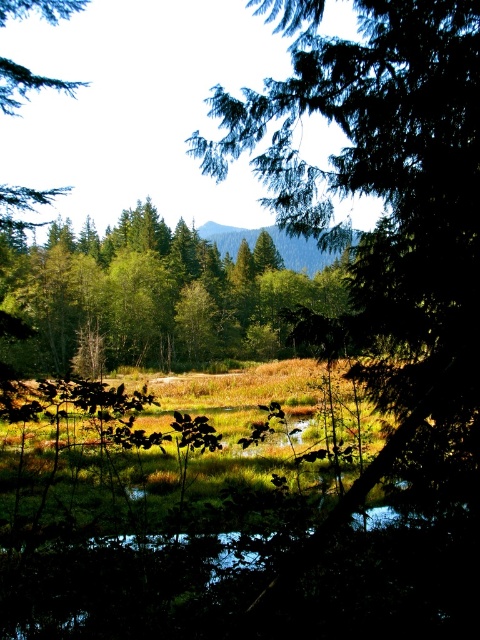
The width and height of the screenshot is (480, 640). What do you see at coordinates (384, 202) in the screenshot?
I see `green matte tree at center` at bounding box center [384, 202].

Is green matte tree at center taller than green leafy tree at center?

Incorrect, green matte tree at center's height is not larger of green leafy tree at center's.

Measure the distance between green matte tree at center and camera.

green matte tree at center is 8.74 feet away from camera.

Where is `green matte tree at center`? The image size is (480, 640). green matte tree at center is located at coordinates (384, 202).